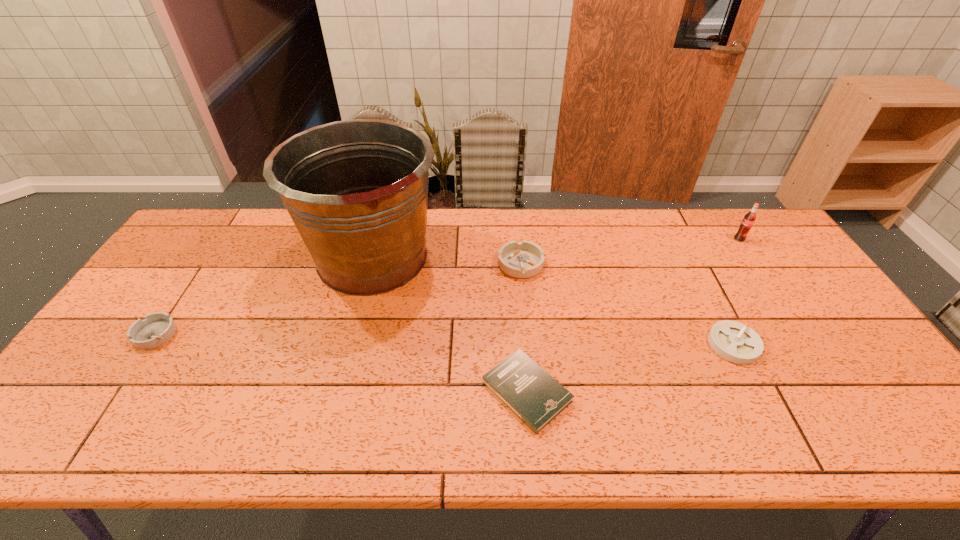
You are a GUI agent. You are given a task and a screenshot of the screen. Output one action in this format:
    pyautogui.click(x=<x>, y=<y>)
    Task: Click on the object that is at the right edge
    The width and height of the screenshot is (960, 540).
    Given the screenshot: What is the action you would take?
    pyautogui.click(x=749, y=219)

The image size is (960, 540). I want to click on object at the far right corner, so [x=749, y=219].

This screenshot has width=960, height=540. In order to click on vacant region at the far edge of the desktop in this screenshot , I will do `click(297, 228)`.

Find the location of a particular element. free spot at the near edge of the desktop is located at coordinates (643, 444).

Image resolution: width=960 pixels, height=540 pixels. Identify the location of vacant space at the left edge. (147, 293).

Find the location of a particular element. The width and height of the screenshot is (960, 540). free space at the far left corner is located at coordinates (209, 231).

In order to click on vacant space at the near left corner in this screenshot , I will do `click(92, 433)`.

This screenshot has height=540, width=960. What are the coordinates of `blank space at the far right corner` in the screenshot? It's located at (736, 231).

The height and width of the screenshot is (540, 960). In the image, there is a desktop. Identify the location of vacant area at the near right corner. (910, 415).

Find the location of `vacant space that is in between the leftmost object and the tallest ashtray`. vacant space that is in between the leftmost object and the tallest ashtray is located at coordinates (338, 299).